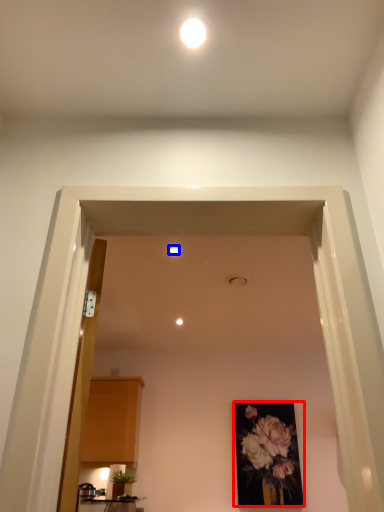
Question: Which point is closer to the camera, picture frame (highlighted by a red box) or lighting (highlighted by a blue box)?

Choices:
 (A) picture frame
 (B) lighting

Answer: (B)